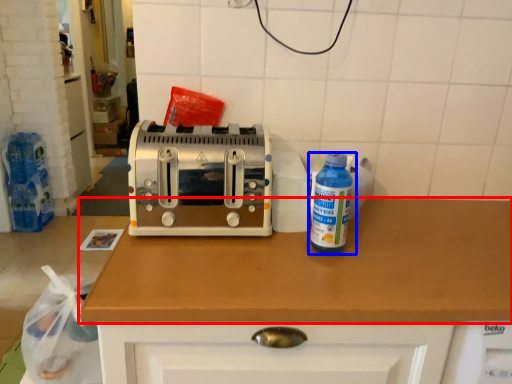
Question: Which of the following is the farthest to the observer, countertop (highlighted by a red box) or bottle (highlighted by a blue box)?

Choices:
 (A) countertop
 (B) bottle

Answer: (B)